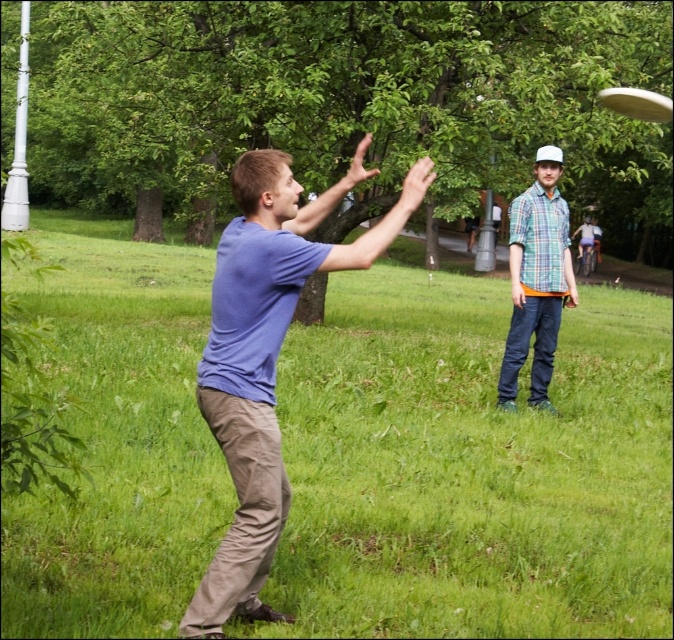
Question: Is blue cotton shirt at center wider than white plastic frisbee at upper right?

Choices:
 (A) no
 (B) yes

Answer: (A)

Question: From the image, what is the correct spatial relationship of green grass at center in relation to checkered fabric shirt at upper right?

Choices:
 (A) left
 (B) right

Answer: (A)

Question: Which point is closer to the camera?

Choices:
 (A) white plastic frisbee at upper right
 (B) blue cotton shirt at center

Answer: (B)

Question: Which point is farther to the camera?

Choices:
 (A) (644, 451)
 (B) (586, 241)
 (C) (640, 116)
 (D) (253, 572)

Answer: (B)

Question: Is blue cotton shirt at center thinner than checkered fabric shirt at center?

Choices:
 (A) no
 (B) yes

Answer: (A)

Question: Among these objects, which one is nearest to the camera?

Choices:
 (A) green grass at center
 (B) checkered fabric shirt at center
 (C) checkered fabric shirt at upper right

Answer: (A)